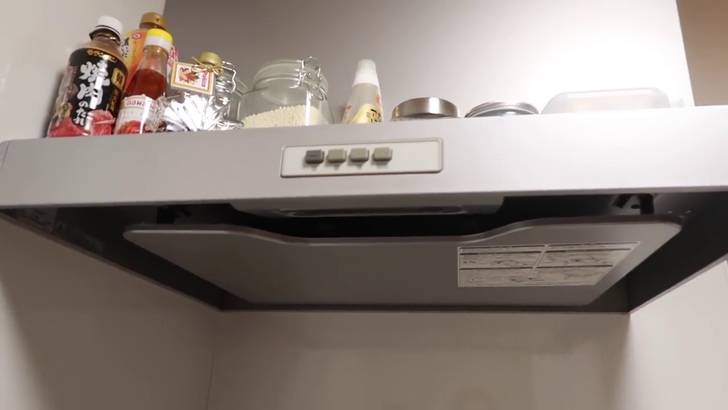
Find the location of `wall`. wall is located at coordinates (62, 355), (15, 54), (636, 30), (486, 374), (705, 321), (713, 23).